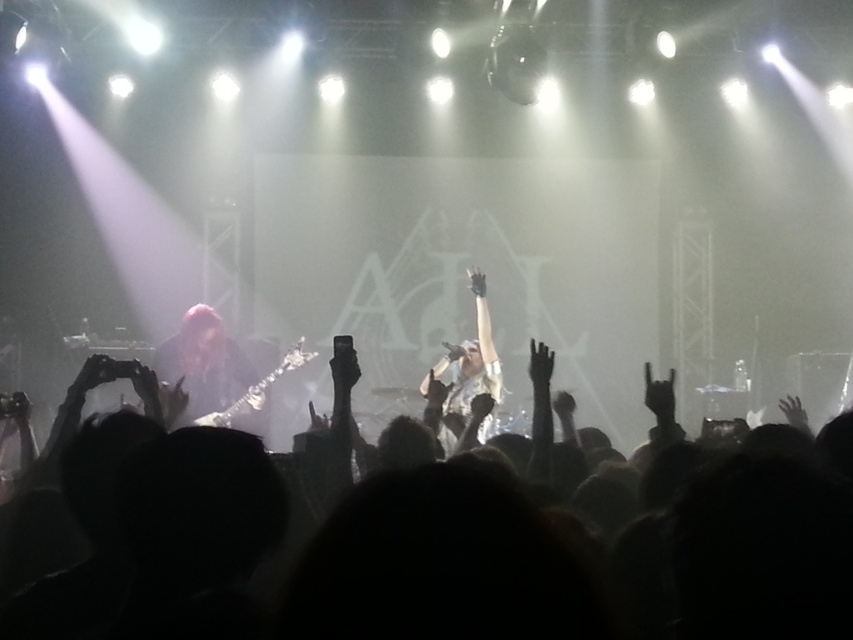
Question: Is silhouette crowd at center in front of shiny red hair at left?

Choices:
 (A) no
 (B) yes

Answer: (B)

Question: Is shiny red hair at left further to the viewer compared to shiny silver microphone at center?

Choices:
 (A) no
 (B) yes

Answer: (B)

Question: Which object is farther from the camera taking this photo?

Choices:
 (A) shiny silver microphone at center
 (B) silhouette crowd at center

Answer: (A)

Question: Based on their relative distances, which object is nearer to the silhouette crowd at center?

Choices:
 (A) shiny red hair at left
 (B) shiny silver microphone at center

Answer: (B)

Question: Is silhouette crowd at center to the left of shiny red hair at left from the viewer's perspective?

Choices:
 (A) yes
 (B) no

Answer: (B)

Question: Which of the following is the farthest from the observer?

Choices:
 (A) (180, 372)
 (B) (450, 440)

Answer: (A)